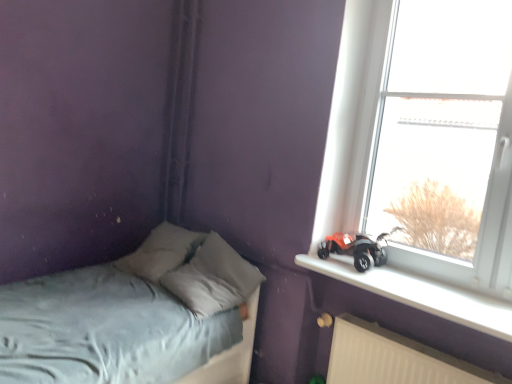
Question: From the image's perspective, is white plastic window sill at upper right above or below orange matte toy car at window sill?

Choices:
 (A) above
 (B) below

Answer: (B)

Question: Is white plastic window sill at upper right inside or outside of orange matte toy car at window sill?

Choices:
 (A) inside
 (B) outside

Answer: (B)

Question: Which is nearer to the white plastic window sill at upper right?

Choices:
 (A) light blue fabric bed at lower left
 (B) white plastic radiator at lower right
 (C) transparent glass window at upper right
 (D) orange matte toy car at window sill
 (E) gray fabric pillow at center

Answer: (D)

Question: Based on their relative distances, which object is farther from the orange matte toy car at window sill?

Choices:
 (A) light blue fabric bed at lower left
 (B) white plastic window sill at upper right
 (C) white plastic radiator at lower right
 (D) transparent glass window at upper right
 (E) gray fabric pillow at center

Answer: (A)